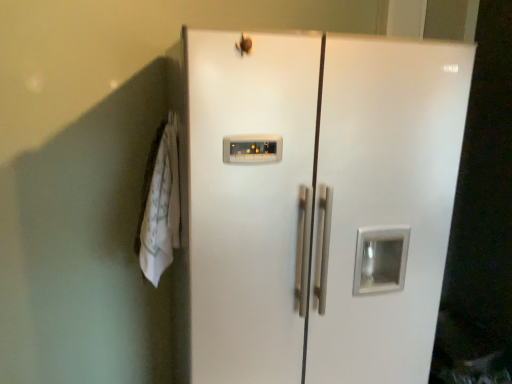
Question: Is white fabric towel at left wider or thinner than white glossy refrigerator at center?

Choices:
 (A) wide
 (B) thin

Answer: (B)

Question: Based on their sizes in the image, would you say white fabric towel at left is bigger or smaller than white glossy refrigerator at center?

Choices:
 (A) small
 (B) big

Answer: (A)

Question: From the image's perspective, relative to white glossy refrigerator at center, is white fabric towel at left above or below?

Choices:
 (A) above
 (B) below

Answer: (A)

Question: From a real-world perspective, is white glossy refrigerator at center above or below white fabric towel at left?

Choices:
 (A) above
 (B) below

Answer: (B)

Question: In terms of width, does white glossy refrigerator at center look wider or thinner when compared to white fabric towel at left?

Choices:
 (A) wide
 (B) thin

Answer: (A)

Question: Would you say white glossy refrigerator at center is to the left or to the right of white fabric towel at left in the picture?

Choices:
 (A) right
 (B) left

Answer: (A)

Question: Is white glossy refrigerator at center bigger or smaller than white fabric towel at left?

Choices:
 (A) big
 (B) small

Answer: (A)